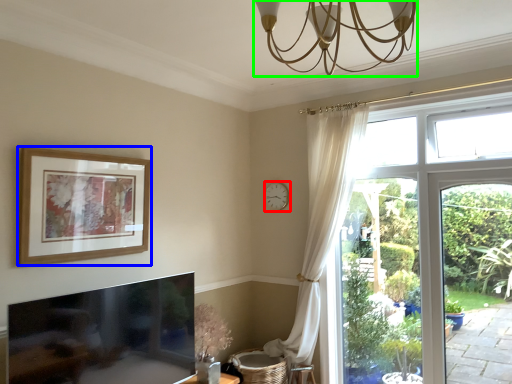
Question: Considering the real-world distances, which object is closest to clock (highlighted by a red box)? picture frame (highlighted by a blue box) or light fixture (highlighted by a green box).

Choices:
 (A) picture frame
 (B) light fixture

Answer: (A)